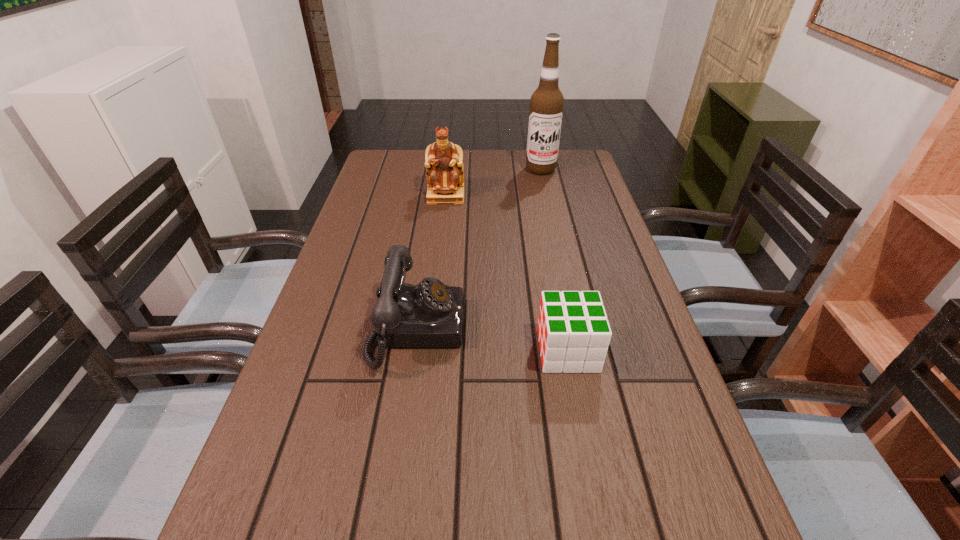
You are a GUI agent. You are given a task and a screenshot of the screen. Output one action in this format:
    pyautogui.click(x=<x>, y=<y>)
    Task: Click on the farthest object
    The width and height of the screenshot is (960, 540).
    Given the screenshot: What is the action you would take?
    pyautogui.click(x=547, y=102)

This screenshot has width=960, height=540. Identify the location of the tallest object. (547, 102).

This screenshot has width=960, height=540. I want to click on the second tallest object, so click(443, 160).

Locate an element on the screen. The image size is (960, 540). figurine is located at coordinates (443, 160).

You are a GUI agent. You are given a task and a screenshot of the screen. Output one action in this format:
    pyautogui.click(x=<x>, y=<y>)
    Task: Click on the second shortest object
    The width and height of the screenshot is (960, 540).
    Given the screenshot: What is the action you would take?
    pyautogui.click(x=430, y=314)

Locate an element on the screen. Image resolution: width=960 pixels, height=540 pixels. cube is located at coordinates (573, 331).

Locate an element on the screen. The width and height of the screenshot is (960, 540). vacant area located on the label of the tallest object is located at coordinates (548, 205).

Where is `free space located 0.340m on the front-facing side of the third nearest object`? The height and width of the screenshot is (540, 960). free space located 0.340m on the front-facing side of the third nearest object is located at coordinates (437, 280).

Locate an element on the screen. The height and width of the screenshot is (540, 960). blank space located on the dial of the telephone is located at coordinates (582, 329).

You are a GUI agent. You are given a task and a screenshot of the screen. Output one action in this format:
    pyautogui.click(x=<x>, y=<y>)
    Task: Click on the free space located on the red face of the shortest object
    The width and height of the screenshot is (960, 540).
    Given the screenshot: What is the action you would take?
    pyautogui.click(x=445, y=350)